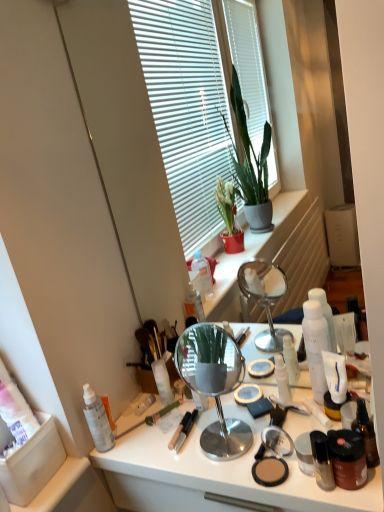
Find the location of a particular element. This screenshot has width=384, height=512. free space to the left of polished silver mirror at center is located at coordinates (158, 446).